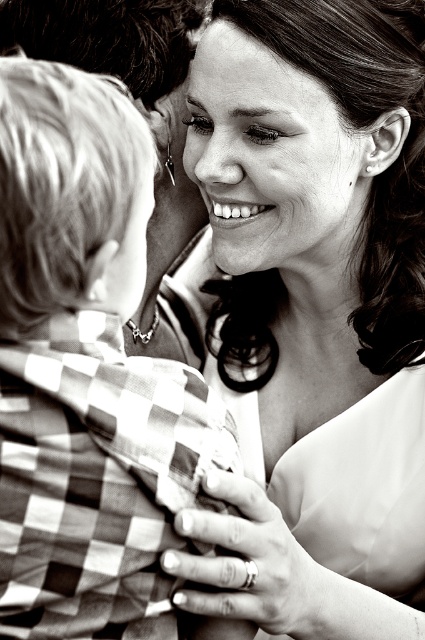
Can you confirm if checkered fabric shirt at left is shorter than smooth skin face at upper center?

No.

Can you confirm if checkered fabric shirt at left is positioned to the left of smooth skin face at upper center?

Indeed, checkered fabric shirt at left is positioned on the left side of smooth skin face at upper center.

Is point (104, 529) positioned behind point (343, 209)?

No, it is in front of (343, 209).

You are a GUI agent. You are given a task and a screenshot of the screen. Output one action in this format:
    pyautogui.click(x=<x>, y=<y>)
    Task: Click on the checkered fabric shirt at left
    The image size is (425, 640).
    Given the screenshot: What is the action you would take?
    pyautogui.click(x=85, y=371)

Between smooth skin at upper center and smooth skin face at upper center, which one is positioned higher?

smooth skin face at upper center is above.

Does smooth skin at upper center have a lesser width compared to smooth skin face at upper center?

In fact, smooth skin at upper center might be wider than smooth skin face at upper center.

What are the coordinates of `smooth skin at upper center` in the screenshot? It's located at (314, 312).

Based on the photo, does smooth skin at upper center have a larger size compared to checkered fabric shirt at left?

Correct, smooth skin at upper center is larger in size than checkered fabric shirt at left.

Is the position of smooth skin at upper center less distant than that of checkered fabric shirt at left?

No, it is not.

Which is behind, point (326, 438) or point (19, 369)?

Point (326, 438)

Find the location of a particular element. The height and width of the screenshot is (640, 425). smooth skin at upper center is located at coordinates (314, 312).